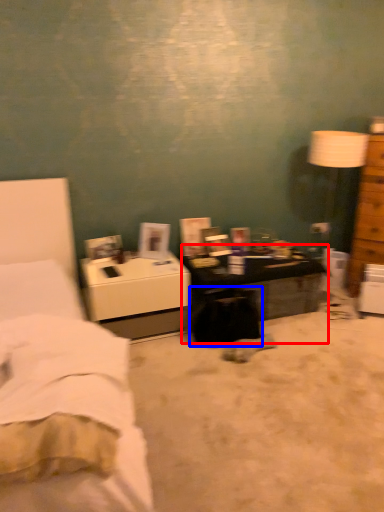
Question: Which object appears closest to the camera in this image, desk (highlighted by a red box) or swivel chair (highlighted by a blue box)?

Choices:
 (A) desk
 (B) swivel chair

Answer: (B)